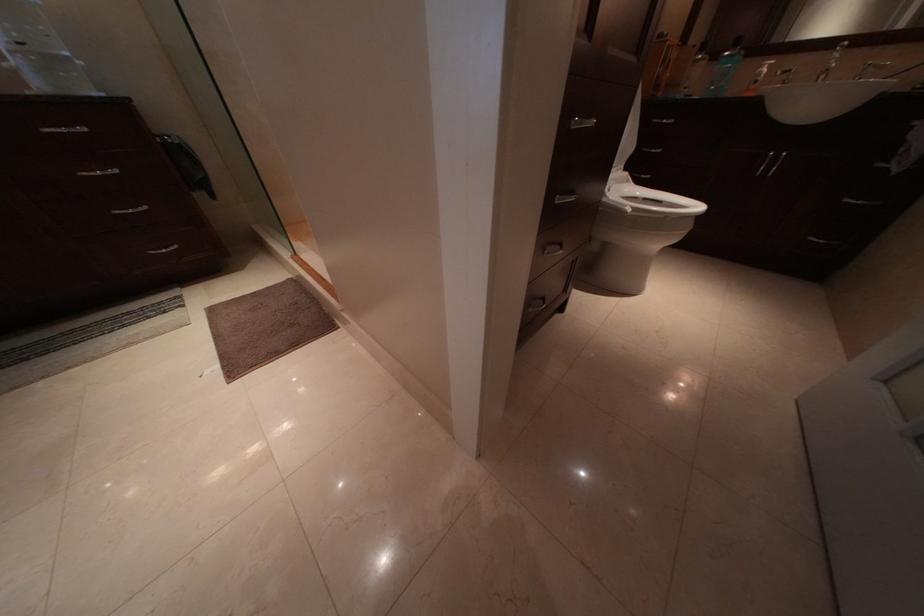
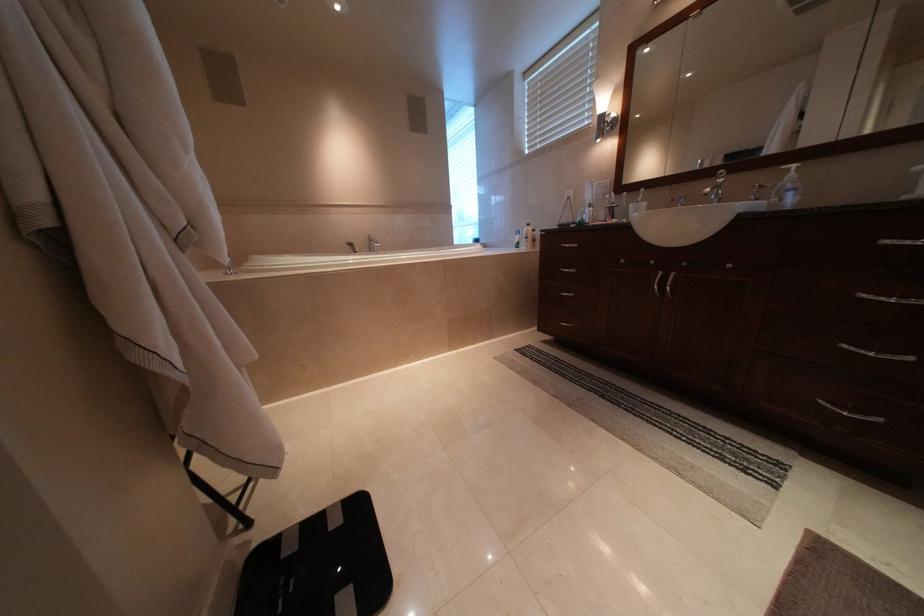
The images are taken continuously from a first-person perspective. In which direction is your viewpoint rotating?

The camera rotated toward left-down.